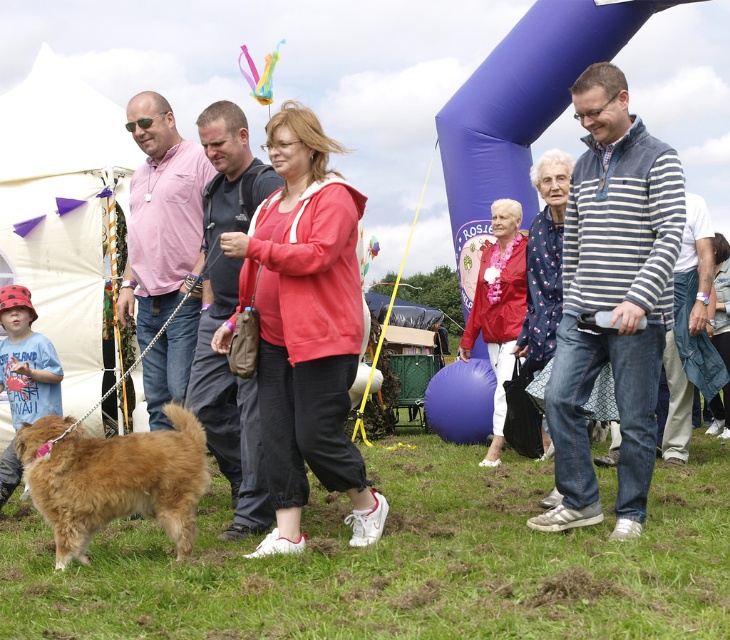
Which is below, striped cotton shirt at center or golden fur dog at lower left?

Positioned lower is golden fur dog at lower left.

From the picture: Does striped cotton shirt at center have a larger size compared to golden fur dog at lower left?

Yes, striped cotton shirt at center is bigger than golden fur dog at lower left.

This screenshot has height=640, width=730. What do you see at coordinates (612, 298) in the screenshot?
I see `striped cotton shirt at center` at bounding box center [612, 298].

Image resolution: width=730 pixels, height=640 pixels. Identify the location of striped cotton shirt at center. (612, 298).

Is golden fur dog at lower left positioned at the back of dark gray cotton shirt at center?

No, golden fur dog at lower left is closer to the viewer.

Is golden fur dog at lower left bigger than dark gray cotton shirt at center?

Actually, golden fur dog at lower left might be smaller than dark gray cotton shirt at center.

Which is behind, point (80, 493) or point (228, 141)?

Point (228, 141)

Image resolution: width=730 pixels, height=640 pixels. Find the location of `golden fur dog at lower left`. golden fur dog at lower left is located at coordinates (115, 480).

Does striped cotton shirt at center have a greater height compared to pink cotton shirt at center?

Yes, striped cotton shirt at center is taller than pink cotton shirt at center.

Can you confirm if striped cotton shirt at center is smaller than pink cotton shirt at center?

Yes.

Who is more forward, (561, 316) or (126, 282)?

Point (561, 316) is more forward.

Identify the location of striped cotton shirt at center. (612, 298).